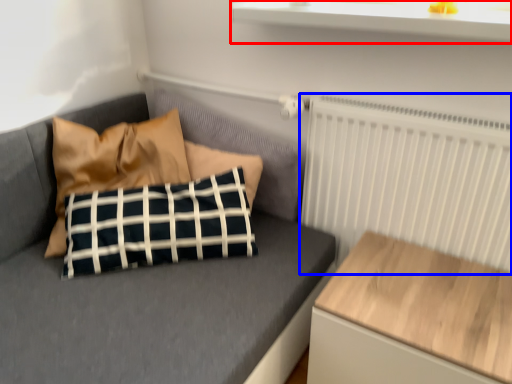
Question: Which object is further to the camera taking this photo, window sill (highlighted by a red box) or radiator (highlighted by a blue box)?

Choices:
 (A) window sill
 (B) radiator

Answer: (B)